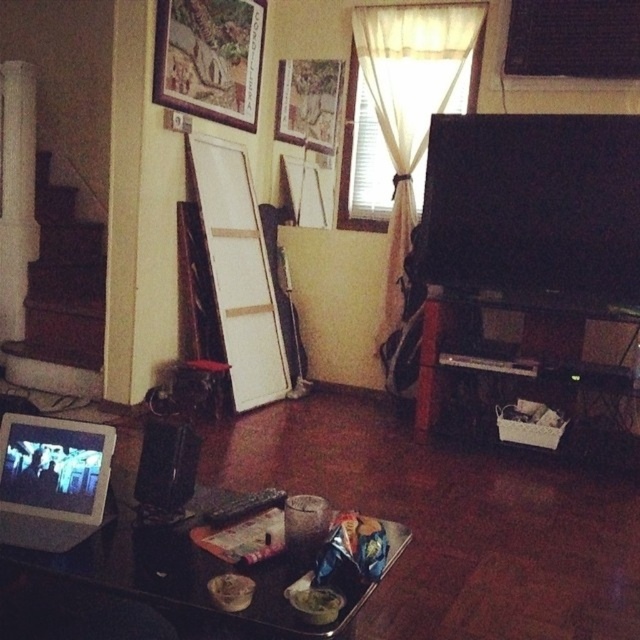
Question: Can you confirm if black glossy entertainment center at right is smaller than wooden textured picture frame at upper center?

Choices:
 (A) no
 (B) yes

Answer: (A)

Question: Which object appears farthest from the camera in this image?

Choices:
 (A) wooden textured picture frame at upper center
 (B) black plastic tray at lower center
 (C) white sheer curtain at upper center

Answer: (C)

Question: Observing the image, what is the correct spatial positioning of matte silver laptop at lower left in reference to wooden textured picture frame at upper center?

Choices:
 (A) below
 (B) above

Answer: (A)

Question: Can you confirm if white matte easel at center is positioned above wooden picture frame at upper center?

Choices:
 (A) yes
 (B) no

Answer: (B)

Question: Based on their relative distances, which object is farther from the black glossy entertainment center at right?

Choices:
 (A) black plastic tray at lower center
 (B) wooden picture frame at upper center
 (C) white matte easel at center

Answer: (A)

Question: Estimate the real-world distances between objects in this image. Which object is farther from the wooden textured picture frame at upper center?

Choices:
 (A) matte silver laptop at lower left
 (B) black plastic tray at lower center
 (C) black glossy entertainment center at right

Answer: (B)